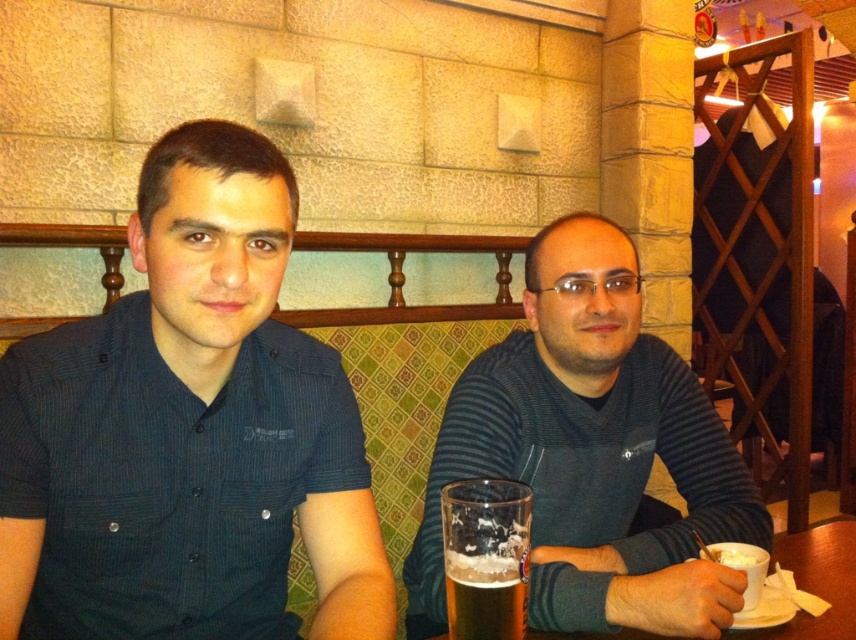
You are a server at a restaurant and need to place a new drink order for the customer wearing the dark gray sweater at center. Where should you place the drink to avoid covering the foamy golden beer at lower center?

The dark gray sweater at center might be wider than the foamy golden beer at lower center, so placing the new drink near the edge of the table away from the foamy golden beer at lower center would ensure it doesn not overlap with the existing items.